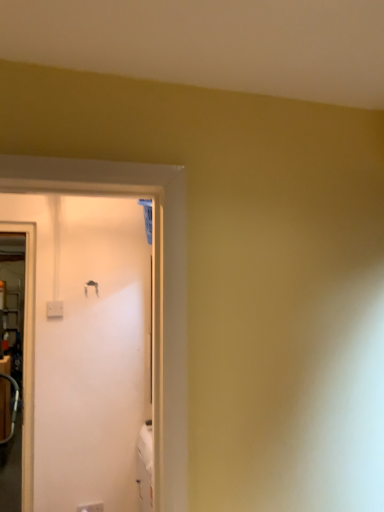
Question: Considering the relative positions of metallic silver door handle at upper left and white plastic electric outlet at lower left in the image provided, is metallic silver door handle at upper left behind white plastic electric outlet at lower left?

Choices:
 (A) yes
 (B) no

Answer: (A)

Question: Considering the relative sizes of metallic silver door handle at upper left and white plastic electric outlet at lower left in the image provided, is metallic silver door handle at upper left wider than white plastic electric outlet at lower left?

Choices:
 (A) no
 (B) yes

Answer: (A)

Question: Considering the relative sizes of metallic silver door handle at upper left and white plastic electric outlet at lower left in the image provided, is metallic silver door handle at upper left taller than white plastic electric outlet at lower left?

Choices:
 (A) yes
 (B) no

Answer: (A)

Question: Is metallic silver door handle at upper left far away from white plastic electric outlet at lower left?

Choices:
 (A) no
 (B) yes

Answer: (B)

Question: Is metallic silver door handle at upper left thinner than white plastic electric outlet at lower left?

Choices:
 (A) no
 (B) yes

Answer: (B)

Question: Is metallic silver door handle at upper left positioned beyond the bounds of white plastic electric outlet at lower left?

Choices:
 (A) yes
 (B) no

Answer: (A)

Question: Is white plastic electric outlet at lower left beside metallic silver door handle at upper left?

Choices:
 (A) no
 (B) yes

Answer: (A)

Question: Does white plastic electric outlet at lower left turn towards metallic silver door handle at upper left?

Choices:
 (A) yes
 (B) no

Answer: (B)

Question: Is white plastic electric outlet at lower left smaller than metallic silver door handle at upper left?

Choices:
 (A) no
 (B) yes

Answer: (A)

Question: From the image's perspective, would you say white plastic electric outlet at lower left is shown under metallic silver door handle at upper left?

Choices:
 (A) no
 (B) yes

Answer: (B)

Question: From a real-world perspective, does white plastic electric outlet at lower left sit lower than metallic silver door handle at upper left?

Choices:
 (A) no
 (B) yes

Answer: (B)

Question: Is metallic silver door handle at upper left a part of white plastic electric outlet at lower left?

Choices:
 (A) no
 (B) yes

Answer: (A)

Question: Is white plastic electric outlet at lower left in front of or behind metallic silver door handle at upper left in the image?

Choices:
 (A) behind
 (B) front

Answer: (B)